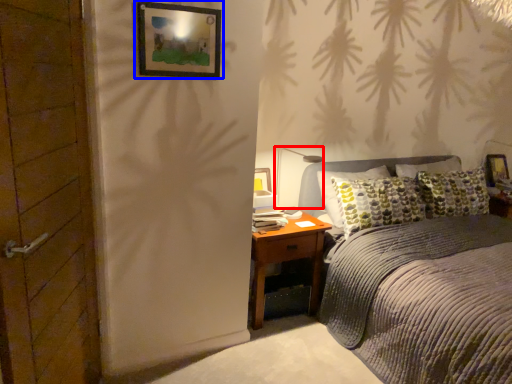
Question: Which object is closer to the camera taking this photo, light fixture (highlighted by a red box) or picture frame (highlighted by a blue box)?

Choices:
 (A) light fixture
 (B) picture frame

Answer: (B)